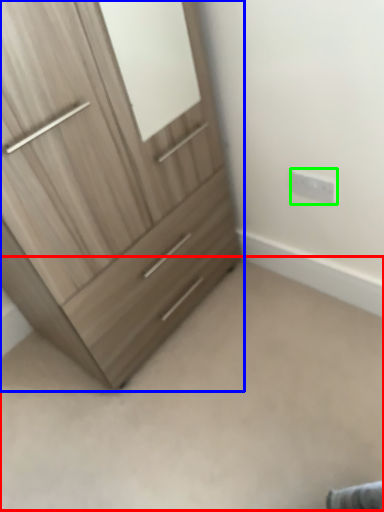
Question: Which object is positioned closest to plain (highlighted by a red box)? Select from chest of drawers (highlighted by a blue box) and electric outlet (highlighted by a green box).

Choices:
 (A) chest of drawers
 (B) electric outlet

Answer: (A)